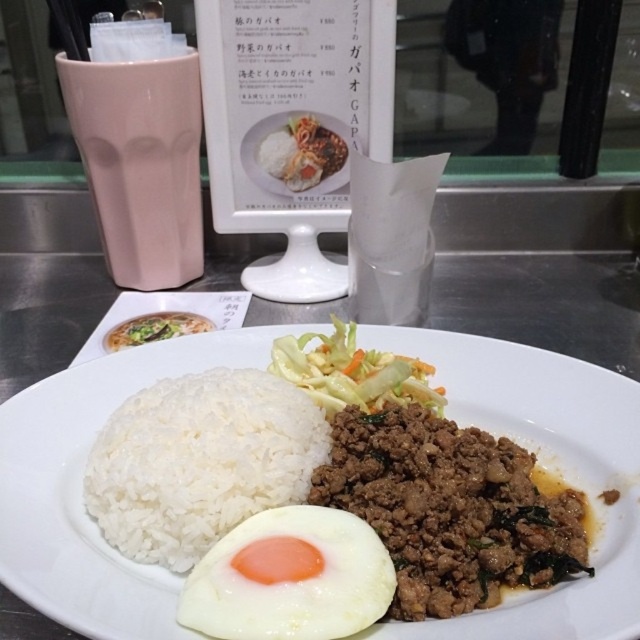
Which is behind, point (32, 573) or point (161, 324)?

Positioned behind is point (161, 324).

Describe the element at coordinates (545, 465) in the screenshot. I see `white matte rice at center` at that location.

Is point (540, 403) in front of point (113, 333)?

That is True.

Identify the location of white matte rice at center. The height and width of the screenshot is (640, 640). (545, 465).

Between white matte rice at center and white fried egg at center, which one has more height?

With more height is white matte rice at center.

Does white matte rice at center appear over white fried egg at center?

Indeed, white matte rice at center is positioned over white fried egg at center.

What do you see at coordinates (545, 465) in the screenshot?
I see `white matte rice at center` at bounding box center [545, 465].

Where is `white matte rice at center`? white matte rice at center is located at coordinates (545, 465).

Who is positioned more to the left, white fried egg at center or green leafy vegetable at center?

From the viewer's perspective, green leafy vegetable at center appears more on the left side.

Is point (342, 518) behind point (193, 332)?

No, it is in front of (193, 332).

I want to click on white fried egg at center, so click(x=289, y=577).